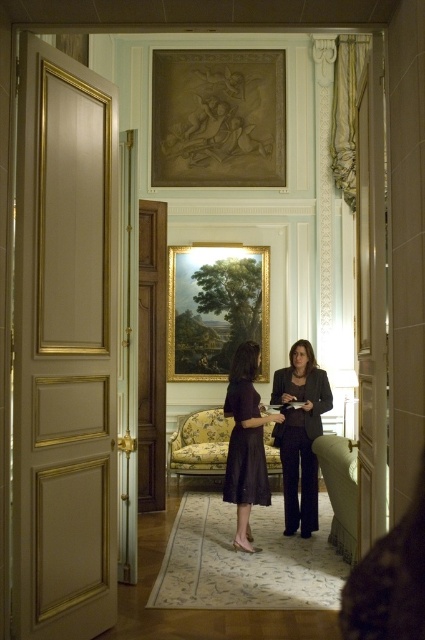
You are standing in the museum and see the point marked at coordinates (300,435). What object is located at that point?

The point at coordinates (300,435) indicates the matte black blazer at center.

You are standing in the museum and looking at two points marked in the image. Which point is closer to you, point (x=272, y=381) or point (x=240, y=436)?

Point (x=240, y=436) is closer to you because it is less further away than point (x=272, y=381).